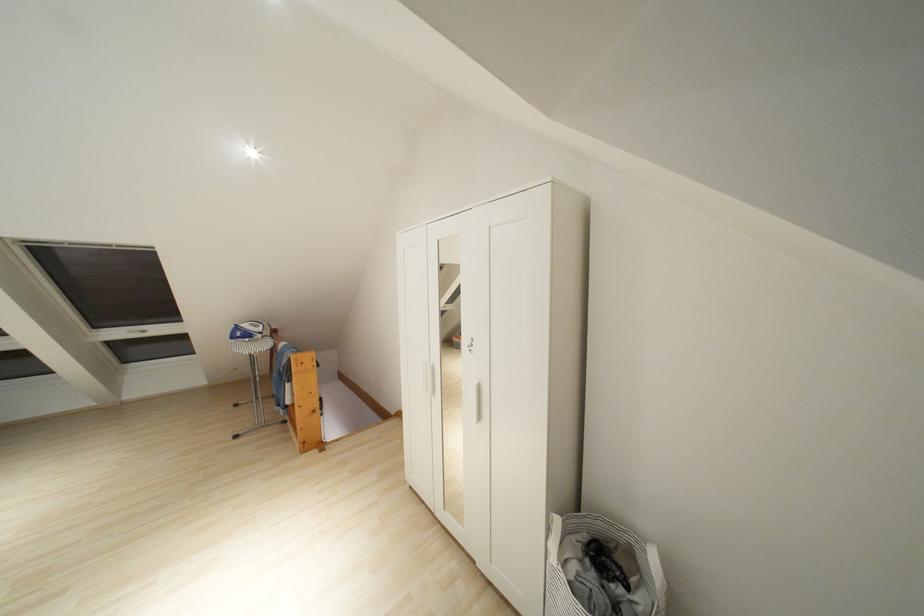
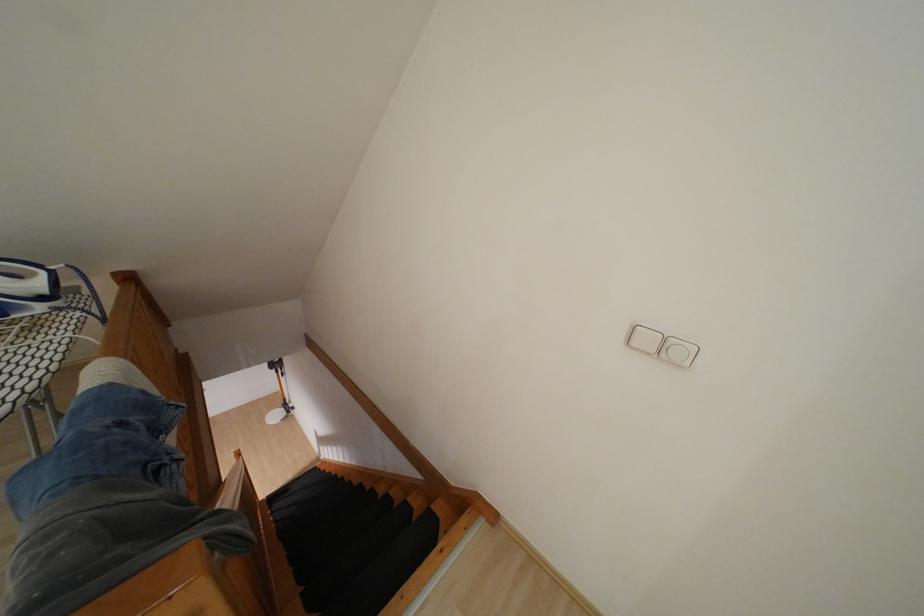
From the picture: Which direction would the cameraman need to move to produce the second image?

The cameraman moved toward left, forward.